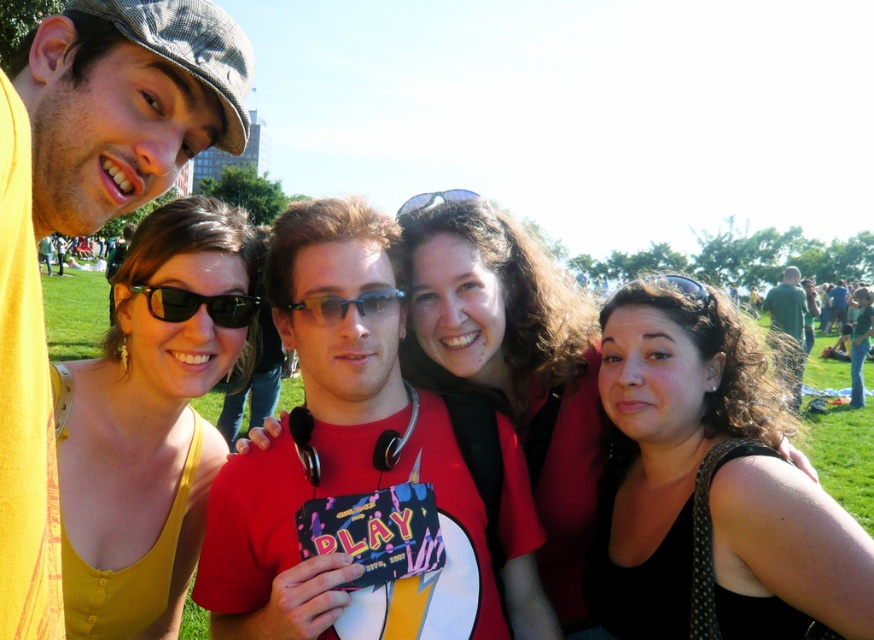
Based on the photo, between matte black backpack at upper right and black rubber goggles at center, which one has more height?

Standing taller between the two is matte black backpack at upper right.

Does matte black backpack at upper right have a larger size compared to black rubber goggles at center?

Yes, matte black backpack at upper right is bigger than black rubber goggles at center.

You are a GUI agent. You are given a task and a screenshot of the screen. Output one action in this format:
    pyautogui.click(x=<x>, y=<y>)
    Task: Click on the matte black backpack at upper right
    This screenshot has height=640, width=874.
    Given the screenshot: What is the action you would take?
    pyautogui.click(x=836, y=305)

This screenshot has width=874, height=640. Describe the element at coordinates (362, 467) in the screenshot. I see `matte plastic wallet at center` at that location.

Is point (299, 250) farther from viewer compared to point (175, 292)?

Yes, it is.

Image resolution: width=874 pixels, height=640 pixels. I want to click on matte plastic wallet at center, so click(362, 467).

Who is positioned more to the right, yellow fabric tank top at left or black rubber goggles at center?

From the viewer's perspective, black rubber goggles at center appears more on the right side.

This screenshot has height=640, width=874. What do you see at coordinates (150, 419) in the screenshot? I see `yellow fabric tank top at left` at bounding box center [150, 419].

This screenshot has height=640, width=874. I want to click on yellow fabric tank top at left, so click(x=150, y=419).